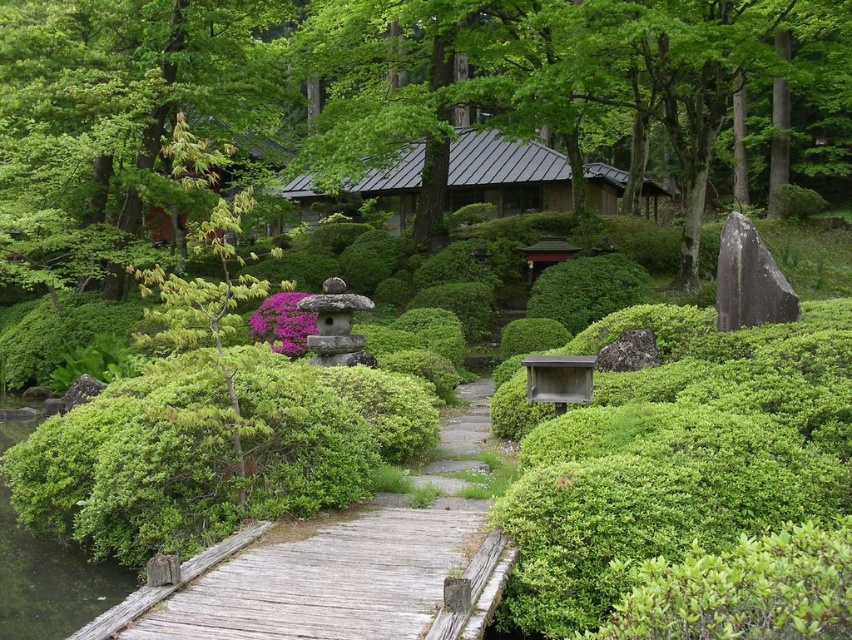
You are standing at the wooden bridge in the Japanese garden. You want to walk to the green leafy tree at upper center. How many steps would you need to take if each step is 2.5 feet long?

The distance between you and the green leafy tree at upper center is 40.11 feet. Dividing this by the step length of 2.5 feet gives approximately 16.04 steps. Since you can only take whole steps, you would need to take 17 steps to reach the tree.

You are a gardener who needs to water both the green leafy tree at upper left and the wooden at left. The watering can you have can cover up to 14 meters. Can you water both without moving the can?

The distance between the green leafy tree at upper left and the wooden at left is 13.56 meters, which is within the 14 meters range of the watering can. Therefore, you can water both without moving the can.

You are a visitor in the Japanese garden and want to take a photo of the wooden at left without the green leafy tree at upper left blocking it. How should you position yourself to achieve this?

Move to the right side of the garden so that the wooden at left is visible without the green leafy tree at upper left blocking it, since the wooden at left is behind the tree.